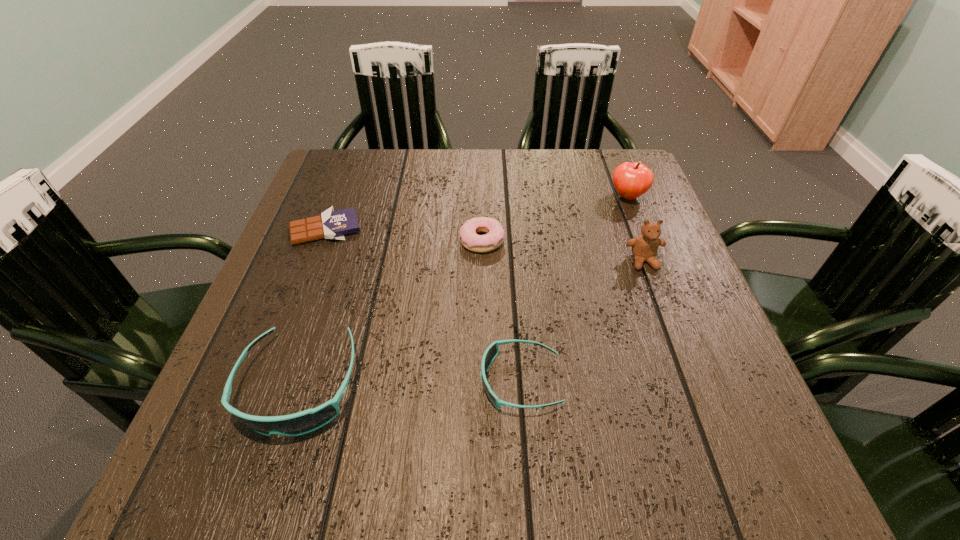
Where is `object situated at the near left corner`? This screenshot has height=540, width=960. object situated at the near left corner is located at coordinates (303, 422).

At what (x,y) coordinates should I click in order to perform the action: click on object at the far right corner. Please return your answer as a coordinate pair (x, y). This screenshot has height=540, width=960. Looking at the image, I should click on 631,180.

In the image, there is a desktop. Identify the location of vacant region at the far edge. (477, 170).

Locate an element on the screen. vacant space at the near edge of the desktop is located at coordinates (391, 390).

You are a GUI agent. You are given a task and a screenshot of the screen. Output one action in this format:
    pyautogui.click(x=<x>, y=<y>)
    Task: Click on the free space at the left edge of the desktop
    
    Given the screenshot: What is the action you would take?
    pyautogui.click(x=296, y=301)

In the image, there is a desktop. At what (x,y) coordinates should I click in order to perform the action: click on vacant area at the right edge. Please return your answer as a coordinate pair (x, y). The height and width of the screenshot is (540, 960). Looking at the image, I should click on (646, 314).

Locate an element on the screen. This screenshot has height=540, width=960. vacant space at the far right corner is located at coordinates coord(609,153).

Identify the location of blank area at the near right corner. This screenshot has width=960, height=540. (676, 395).

Locate an element on the screen. This screenshot has width=960, height=540. free space between the second shortest object and the left sunglasses is located at coordinates (391, 312).

Find the location of a particular element. The width and height of the screenshot is (960, 540). free space between the doughnut and the right sunglasses is located at coordinates (501, 310).